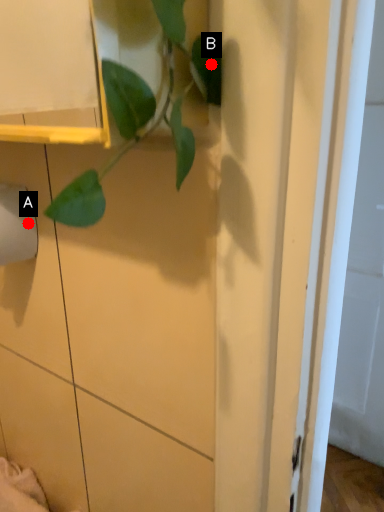
Question: Two points are circled on the image, labeled by A and B beside each circle. Among these points, which one is farthest from the camera?

Choices:
 (A) A is further
 (B) B is further

Answer: (A)